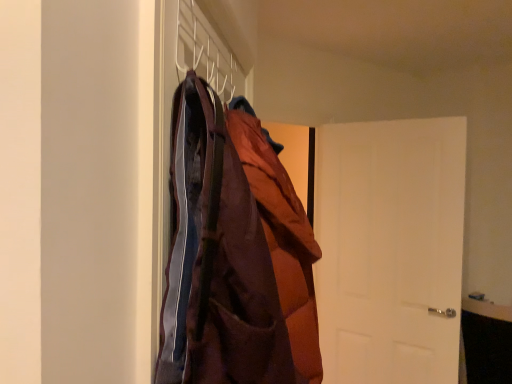
Question: Considering the relative positions of white matte door at right and brown quilted jacket at center in the image provided, is white matte door at right to the right of brown quilted jacket at center from the viewer's perspective?

Choices:
 (A) no
 (B) yes

Answer: (B)

Question: Can you confirm if white matte door at right is bigger than brown quilted jacket at center?

Choices:
 (A) yes
 (B) no

Answer: (A)

Question: From a real-world perspective, is white matte door at right positioned over brown quilted jacket at center based on gravity?

Choices:
 (A) no
 (B) yes

Answer: (A)

Question: Can you confirm if white matte door at right is taller than brown quilted jacket at center?

Choices:
 (A) no
 (B) yes

Answer: (B)

Question: Does white matte door at right have a lesser height compared to brown quilted jacket at center?

Choices:
 (A) yes
 (B) no

Answer: (B)

Question: Is white matte door at right located outside brown quilted jacket at center?

Choices:
 (A) no
 (B) yes

Answer: (B)

Question: Does brown quilted jacket at center appear on the left side of white matte coat hanger at upper center?

Choices:
 (A) yes
 (B) no

Answer: (B)

Question: Does brown quilted jacket at center have a greater height compared to white matte coat hanger at upper center?

Choices:
 (A) yes
 (B) no

Answer: (A)

Question: Is white matte coat hanger at upper center at the back of brown quilted jacket at center?

Choices:
 (A) no
 (B) yes

Answer: (A)

Question: From the image's perspective, would you say brown quilted jacket at center is positioned over white matte coat hanger at upper center?

Choices:
 (A) no
 (B) yes

Answer: (A)

Question: Does brown quilted jacket at center touch white matte coat hanger at upper center?

Choices:
 (A) yes
 (B) no

Answer: (B)

Question: Is brown quilted jacket at center completely or partially outside of white matte coat hanger at upper center?

Choices:
 (A) no
 (B) yes

Answer: (B)

Question: From a real-world perspective, is white matte door at right positioned under white matte coat hanger at upper center based on gravity?

Choices:
 (A) no
 (B) yes

Answer: (B)